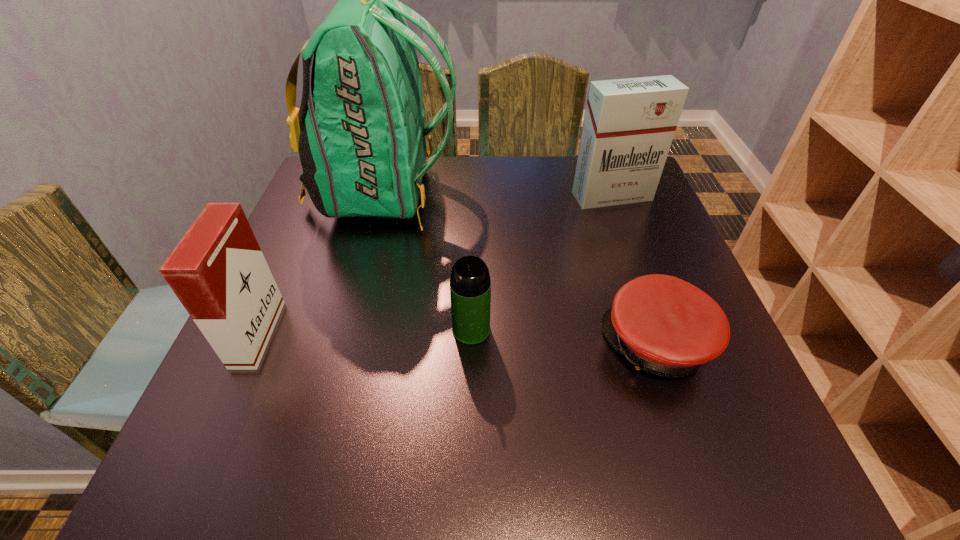
You are a GUI agent. You are given a task and a screenshot of the screen. Output one action in this format:
    pyautogui.click(x=<x>, y=<y>)
    Task: Click on the free location located 0.120m on the front-facing side of the left cigarette_case
    The height and width of the screenshot is (540, 960).
    Given the screenshot: What is the action you would take?
    pyautogui.click(x=335, y=334)

Where is `vacant space situated from the spout of the thermos bottle`? vacant space situated from the spout of the thermos bottle is located at coordinates (470, 394).

The image size is (960, 540). Identify the location of vacant space located at the front of the shortest object where the visor is located. (426, 345).

What are the coordinates of `free space located 0.400m at the front of the shortest object where the visor is located` in the screenshot? It's located at (388, 345).

You are a GUI agent. You are given a task and a screenshot of the screen. Output one action in this format:
    pyautogui.click(x=<x>, y=<y>)
    Task: Click on the vacant space located at the front of the shortest object where the visor is located
    
    Given the screenshot: What is the action you would take?
    pyautogui.click(x=474, y=345)

You are a GUI agent. You are given a task and a screenshot of the screen. Output one action in this format:
    pyautogui.click(x=<x>, y=<y>)
    Task: Click on the backpack that is positioned at the far edge
    The height and width of the screenshot is (540, 960).
    Given the screenshot: What is the action you would take?
    pyautogui.click(x=360, y=134)

The height and width of the screenshot is (540, 960). I want to click on cigarette case that is at the far edge, so click(x=629, y=124).

The width and height of the screenshot is (960, 540). In order to click on backpack at the left edge in this screenshot , I will do `click(360, 134)`.

I want to click on cigarette_case at the left edge, so click(x=218, y=272).

Where is `cigarette case that is at the right edge`? cigarette case that is at the right edge is located at coordinates coord(629,124).